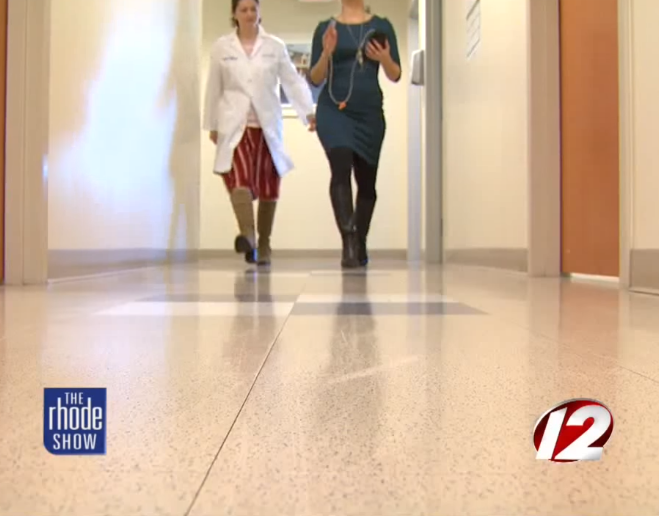
Where is `painting on wall`? painting on wall is located at coordinates (304, 46).